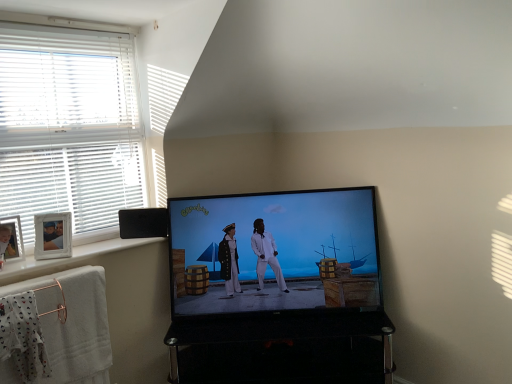
Question: Is wooden photo frame at left inside the boundaries of white cotton cloth at lower left, or outside?

Choices:
 (A) inside
 (B) outside

Answer: (B)

Question: Looking at the image, does wooden photo frame at left seem bigger or smaller compared to white cotton cloth at lower left?

Choices:
 (A) small
 (B) big

Answer: (A)

Question: Estimate the real-world distances between objects in this image. Which object is closer to the wooden photo frame at left?

Choices:
 (A) shiny black screen at center
 (B) white cotton cloth at lower left
 (C) white blinds at left
 (D) black glossy tv stand at lower center
 (E) white painted wood at lower left

Answer: (E)

Question: Estimate the real-world distances between objects in this image. Which object is farther from the white blinds at left?

Choices:
 (A) shiny black screen at center
 (B) white cotton bath towel at lower left
 (C) white cotton cloth at lower left
 (D) white painted wood at lower left
 (E) wooden photo frame at left

Answer: (C)